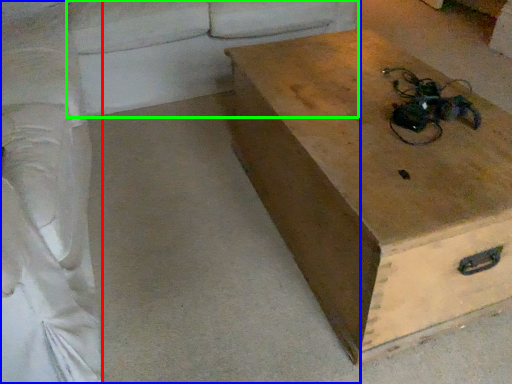
Question: Considering the real-world distances, which object is farthest from couch (highlighted by a red box)? studio couch (highlighted by a blue box) or couch (highlighted by a green box)?

Choices:
 (A) studio couch
 (B) couch

Answer: (B)